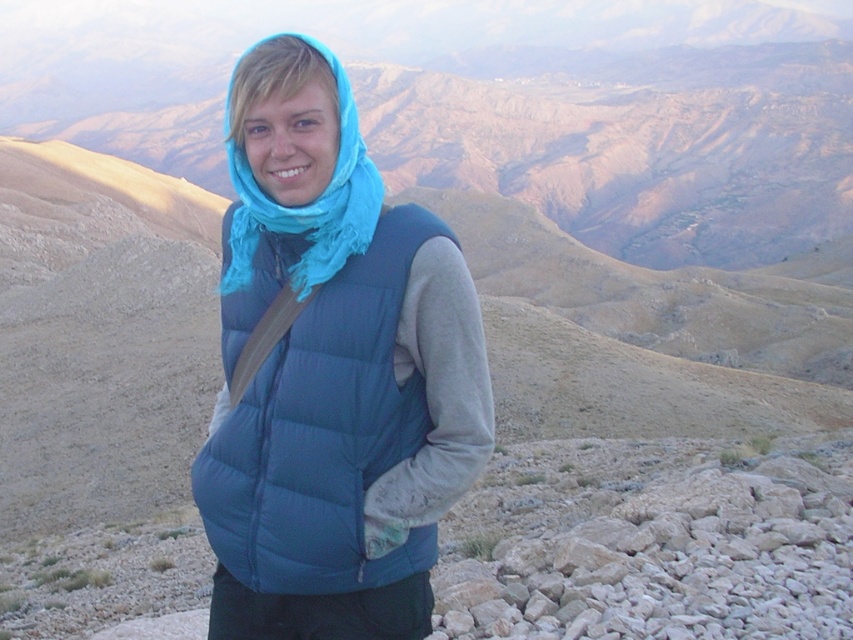
Question: Can you confirm if matte blue puffer vest at center is positioned above turquoise soft scarf at center?

Choices:
 (A) yes
 (B) no

Answer: (B)

Question: Is matte blue puffer vest at center thinner than turquoise soft scarf at center?

Choices:
 (A) yes
 (B) no

Answer: (A)

Question: Which point appears closest to the camera in this image?

Choices:
 (A) (340, 218)
 (B) (387, 256)

Answer: (B)

Question: Is matte blue puffer vest at center thinner than turquoise soft scarf at center?

Choices:
 (A) no
 (B) yes

Answer: (B)